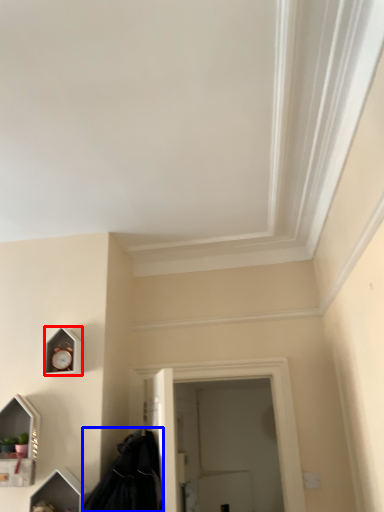
Question: Which of the following is the closest to the observer, clock (highlighted by a red box) or cloak (highlighted by a blue box)?

Choices:
 (A) clock
 (B) cloak

Answer: (B)